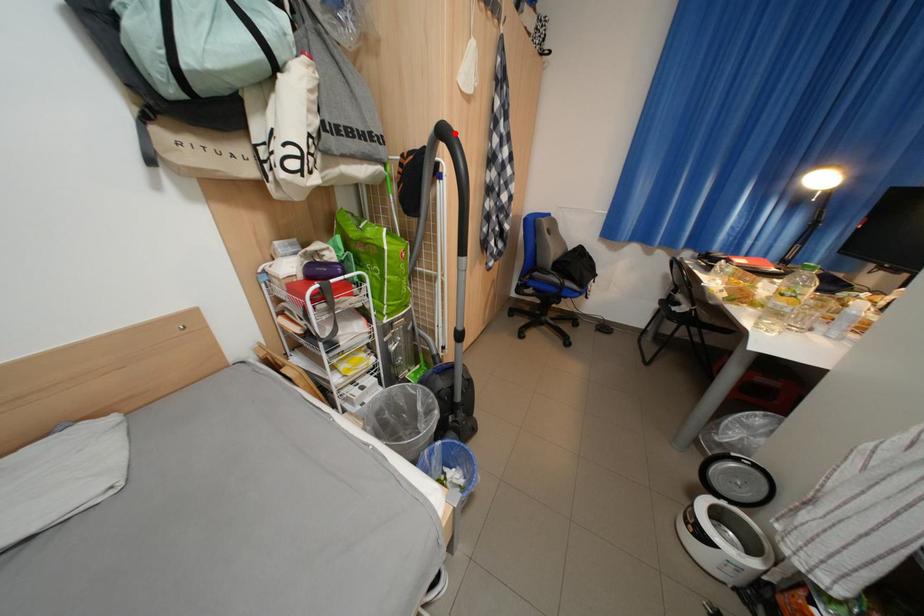
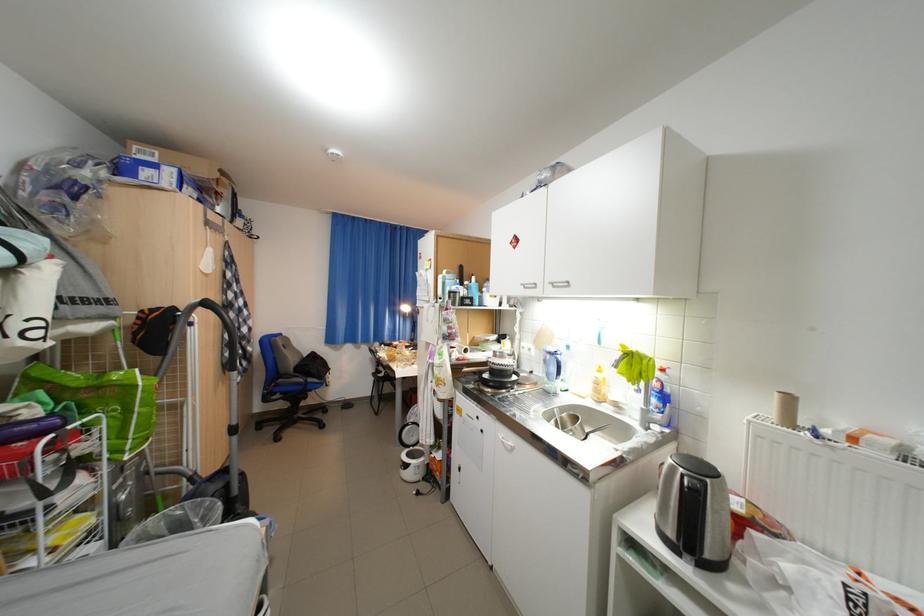
Locate, in the second image, the point that corresponds to the highlighted location in the first image.

(217, 305)